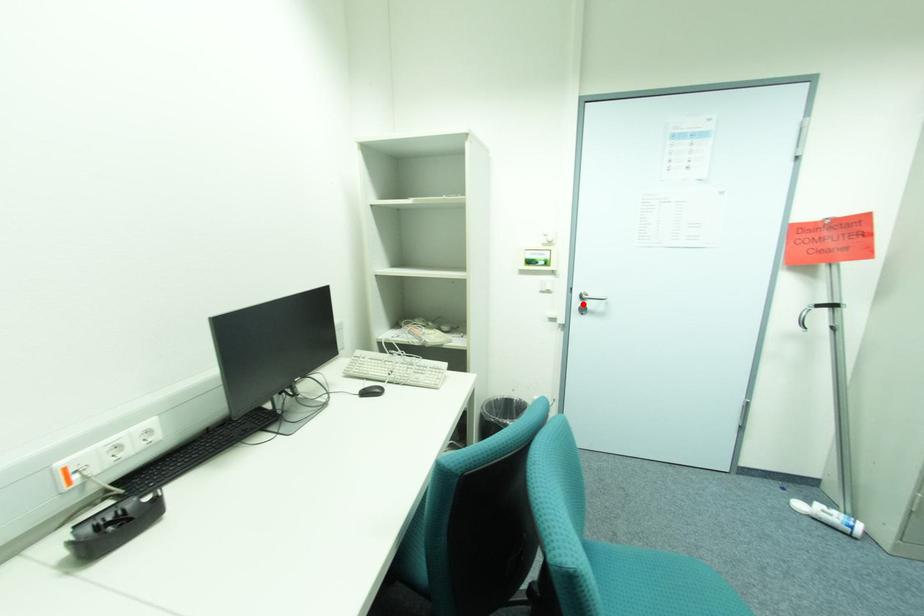
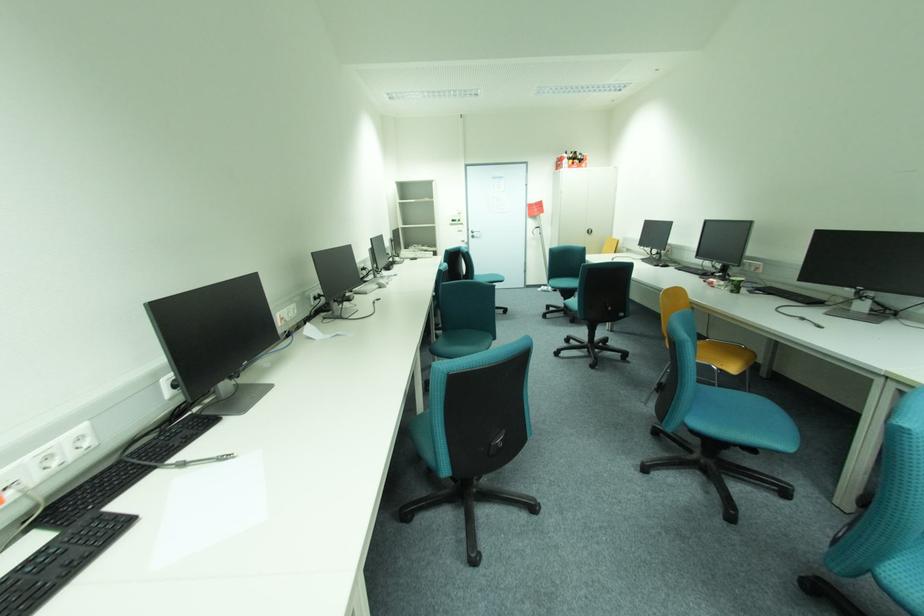
The point at the highlighted location is marked in the first image. Where is the corresponding point in the second image?

(477, 235)